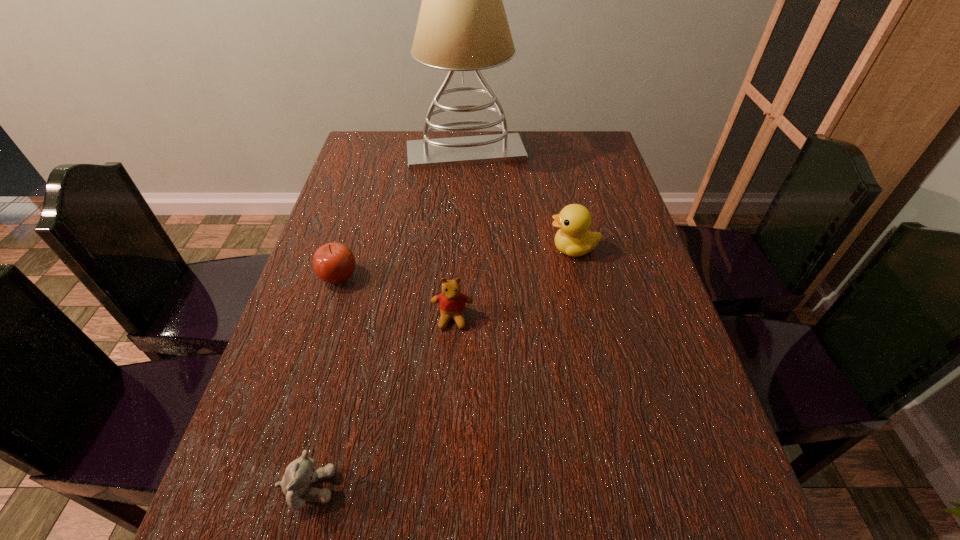
What are the coordinates of `vacant space at the far edge of the desktop` in the screenshot? It's located at (448, 131).

Where is `vacant point at the left edge`? vacant point at the left edge is located at coordinates (321, 405).

Where is `free region at the right edge`? This screenshot has width=960, height=540. free region at the right edge is located at coordinates (603, 176).

Where is `vacant space at the far left corner`? The width and height of the screenshot is (960, 540). vacant space at the far left corner is located at coordinates (363, 154).

What are the coordinates of `vacant space at the far right corner of the desktop` in the screenshot? It's located at (587, 154).

Locate an element on the screen. This screenshot has height=540, width=960. free space between the table lamp and the shortest object is located at coordinates (387, 320).

Locate an element on the screen. The width and height of the screenshot is (960, 540). unoccupied area between the table lamp and the shortest object is located at coordinates (387, 320).

The height and width of the screenshot is (540, 960). I want to click on free space between the nearest object and the taller teddy bear, so click(380, 403).

Identify the location of empty space between the right teddy bear and the third farthest object. (396, 297).

In order to click on vacant space in between the farthest object and the right teddy bear in this screenshot , I will do `click(459, 235)`.